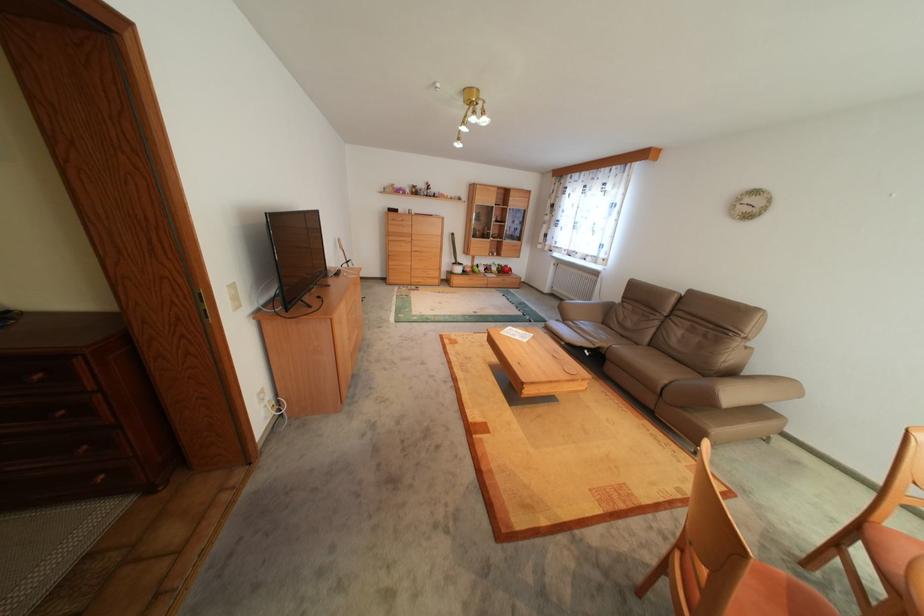
Find the location of a particular element. The width and height of the screenshot is (924, 616). round coaster is located at coordinates (569, 368).